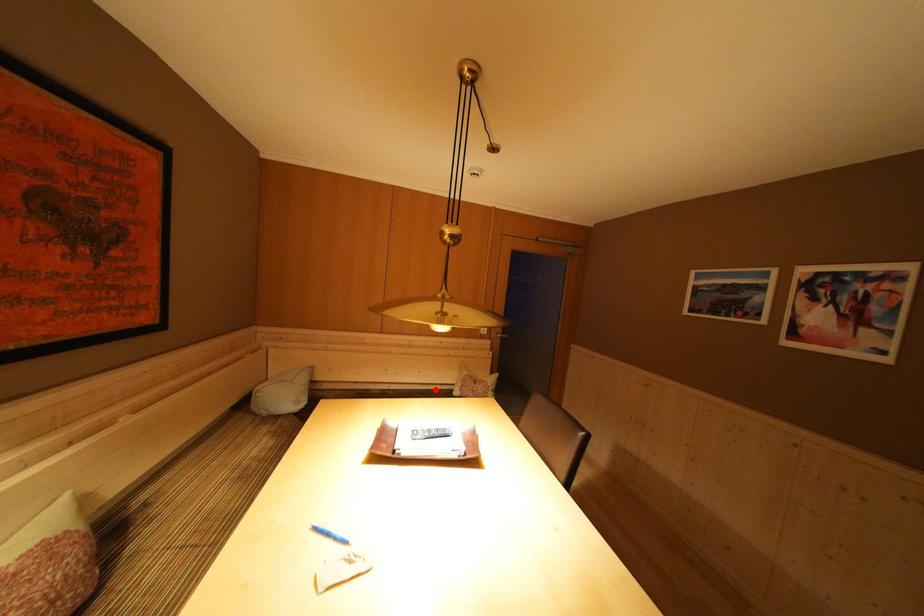
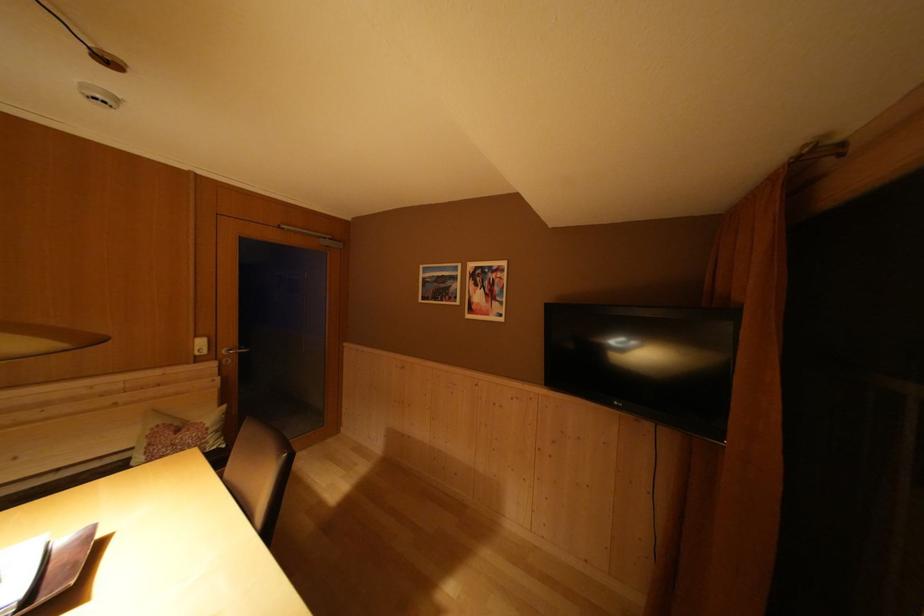
Question: I am providing you with two images of the same scene from different viewpoints. Given a red point in image1, look at the same physical point in image2. Is it:

Choices:
 (A) Closer to the viewpoint
 (B) Farther from the viewpoint

Answer: (A)